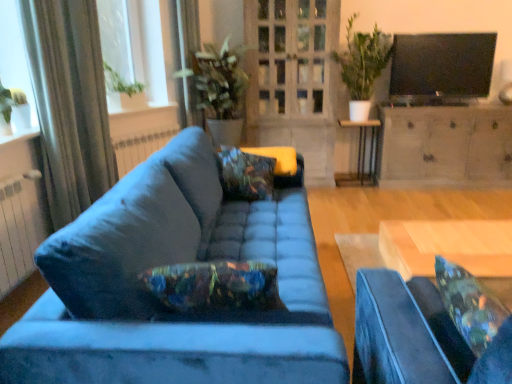
Question: Which direction should I rotate to look at velvet blue studio couch at center, which appears as the first studio couch when viewed from the right, — up or down?

Choices:
 (A) up
 (B) down

Answer: (B)

Question: Is wooden desk at center thinner than clear glass window at upper left?

Choices:
 (A) no
 (B) yes

Answer: (A)

Question: Considering the relative sizes of wooden desk at center and clear glass window at upper left in the image provided, is wooden desk at center shorter than clear glass window at upper left?

Choices:
 (A) yes
 (B) no

Answer: (A)

Question: Does wooden desk at center appear on the right side of clear glass window at upper left?

Choices:
 (A) no
 (B) yes

Answer: (B)

Question: Can you confirm if wooden desk at center is smaller than clear glass window at upper left?

Choices:
 (A) no
 (B) yes

Answer: (B)

Question: From a real-world perspective, is wooden desk at center physically above clear glass window at upper left?

Choices:
 (A) yes
 (B) no

Answer: (B)

Question: Is the surface of wooden desk at center in direct contact with clear glass window at upper left?

Choices:
 (A) yes
 (B) no

Answer: (B)

Question: Considering the relative positions of floral fabric pillow at center and matte white radiator at left, placed as the second radiator when sorted from front to back, in the image provided, is floral fabric pillow at center to the left of matte white radiator at left, placed as the second radiator when sorted from front to back, from the viewer's perspective?

Choices:
 (A) no
 (B) yes

Answer: (A)

Question: Can we say floral fabric pillow at center lies outside matte white radiator at left, placed as the second radiator when sorted from front to back?

Choices:
 (A) no
 (B) yes

Answer: (B)

Question: Can you confirm if floral fabric pillow at center is smaller than matte white radiator at left, the first radiator viewed from the back?

Choices:
 (A) yes
 (B) no

Answer: (B)

Question: Could you tell me if floral fabric pillow at center is turned towards matte white radiator at left, placed as the second radiator when sorted from front to back?

Choices:
 (A) no
 (B) yes

Answer: (A)

Question: From a real-world perspective, is floral fabric pillow at center positioned under matte white radiator at left, the 2th radiator ordered from the bottom, based on gravity?

Choices:
 (A) no
 (B) yes

Answer: (A)

Question: Does floral fabric pillow at center have a lesser height compared to matte white radiator at left, the first radiator viewed from the back?

Choices:
 (A) no
 (B) yes

Answer: (B)

Question: Is velvet blue studio couch at center, the second studio couch from the left, completely or partially inside floral fabric pillow at center?

Choices:
 (A) no
 (B) yes

Answer: (A)